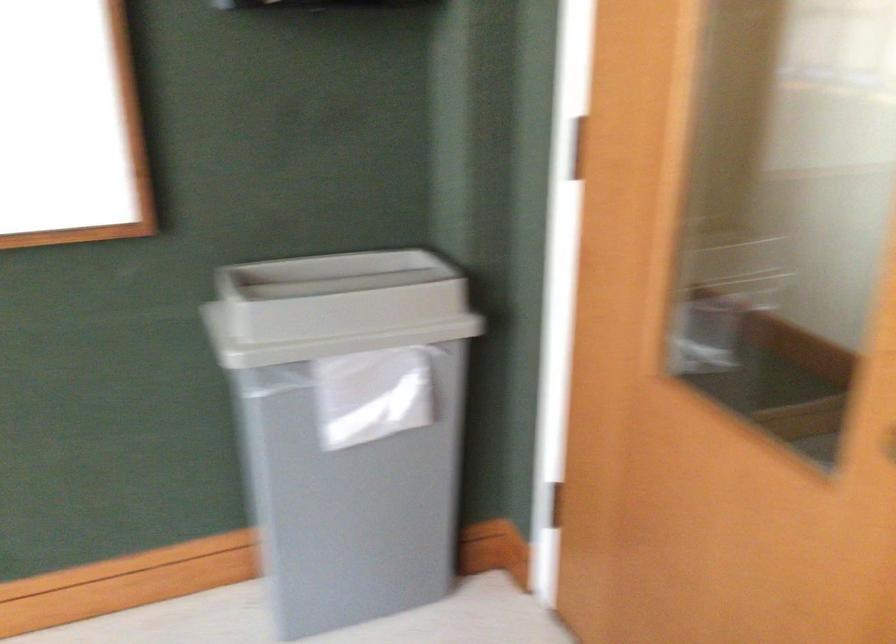
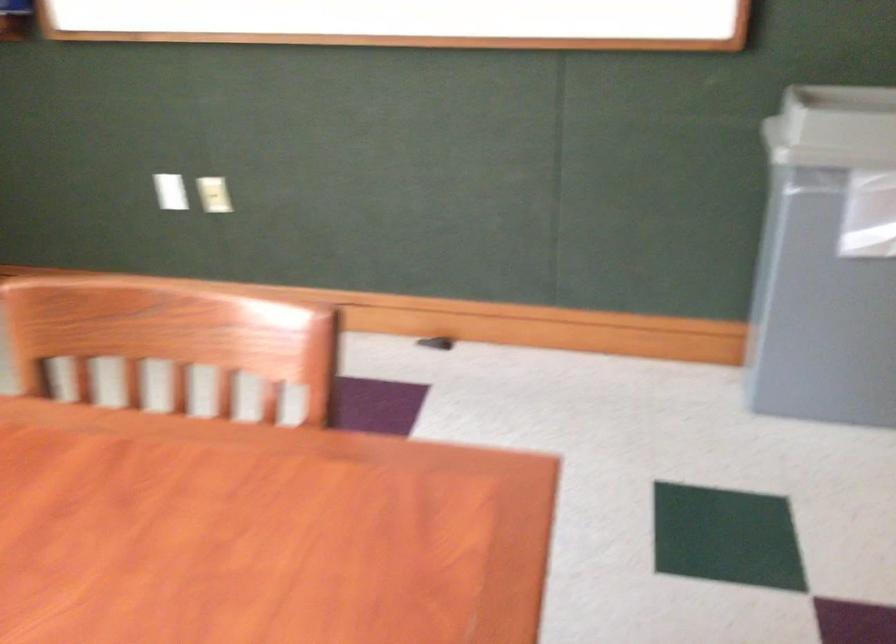
Question: The camera is either moving clockwise (left) or counter-clockwise (right) around the object. The first image is from the beginning of the video and the second image is from the end. Is the camera moving left or right when shooting the video?

Choices:
 (A) Left
 (B) Right

Answer: (B)